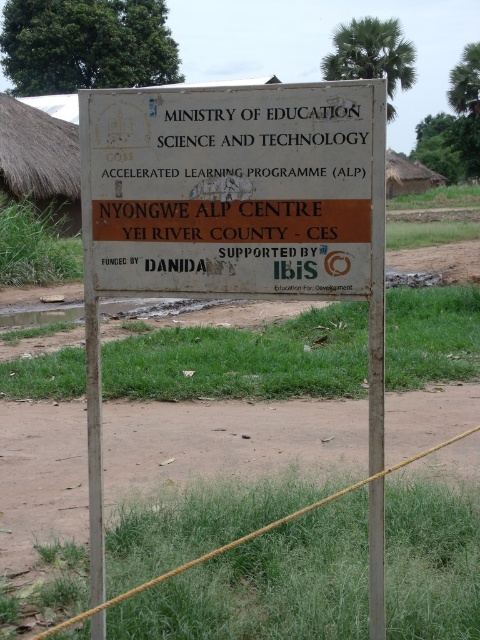
You are standing in front of the signboard and want to touch both the white wooden sign at center and the white painted wood sign at center. Which one can you reach first without moving your position?

The white wooden sign at center is closer to you than the white painted wood sign at center, so you can reach it first without moving.

You are standing in front of the signboard described in the scene. Which object is positioned to the left of the other between the white wooden sign at center and the white painted wood sign at center?

The white wooden sign at center is positioned to the left of the white painted wood sign at center.